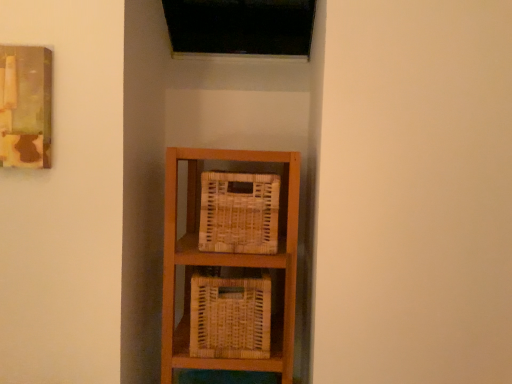
Question: From the image's perspective, would you say woven natural basket at center, marked as the 2th basket in a bottom-to-top arrangement, is positioned over woven wood basket at center, arranged as the first basket when ordered from the bottom?

Choices:
 (A) yes
 (B) no

Answer: (A)

Question: Is woven natural basket at center, marked as the 2th basket in a bottom-to-top arrangement, shorter than woven wood basket at center, arranged as the first basket when ordered from the bottom?

Choices:
 (A) yes
 (B) no

Answer: (A)

Question: Are woven natural basket at center, positioned as the first basket in top-to-bottom order, and woven wood basket at center, arranged as the first basket when ordered from the bottom, making contact?

Choices:
 (A) no
 (B) yes

Answer: (A)

Question: Is the position of woven natural basket at center, marked as the 2th basket in a bottom-to-top arrangement, more distant than that of woven wood basket at center, arranged as the first basket when ordered from the bottom?

Choices:
 (A) no
 (B) yes

Answer: (B)

Question: Does woven natural basket at center, marked as the 2th basket in a bottom-to-top arrangement, have a lesser width compared to woven wood basket at center, arranged as the first basket when ordered from the bottom?

Choices:
 (A) no
 (B) yes

Answer: (B)

Question: Is woven wood basket at center, arranged as the first basket when ordered from the bottom, wider or thinner than woven natural basket at center, positioned as the first basket in top-to-bottom order?

Choices:
 (A) wide
 (B) thin

Answer: (A)

Question: From a real-world perspective, is woven wood basket at center, arranged as the first basket when ordered from the bottom, physically located above or below woven natural basket at center, marked as the 2th basket in a bottom-to-top arrangement?

Choices:
 (A) below
 (B) above

Answer: (A)

Question: In the image, is woven wood basket at center, arranged as the first basket when ordered from the bottom, positioned in front of or behind woven natural basket at center, marked as the 2th basket in a bottom-to-top arrangement?

Choices:
 (A) behind
 (B) front

Answer: (B)

Question: Is woven wood basket at center, acting as the second basket starting from the top, inside the boundaries of woven natural basket at center, marked as the 2th basket in a bottom-to-top arrangement, or outside?

Choices:
 (A) outside
 (B) inside

Answer: (A)

Question: Considering the relative positions of woven natural basket at center, marked as the 2th basket in a bottom-to-top arrangement, and woven wood basket at center, acting as the second basket starting from the top, in the image provided, is woven natural basket at center, marked as the 2th basket in a bottom-to-top arrangement, to the left or to the right of woven wood basket at center, acting as the second basket starting from the top,?

Choices:
 (A) right
 (B) left

Answer: (A)

Question: Choose the correct answer: Is woven natural basket at center, positioned as the first basket in top-to-bottom order, inside woven wood basket at center, acting as the second basket starting from the top, or outside it?

Choices:
 (A) inside
 (B) outside

Answer: (B)

Question: In the image, is woven natural basket at center, positioned as the first basket in top-to-bottom order, positioned in front of or behind woven wood basket at center, acting as the second basket starting from the top?

Choices:
 (A) front
 (B) behind

Answer: (B)

Question: From their relative heights in the image, would you say woven natural basket at center, marked as the 2th basket in a bottom-to-top arrangement, is taller or shorter than woven wood basket at center, arranged as the first basket when ordered from the bottom?

Choices:
 (A) tall
 (B) short

Answer: (B)

Question: Is wooden painting at upper left wider or thinner than woven wood basket at center, arranged as the first basket when ordered from the bottom?

Choices:
 (A) wide
 (B) thin

Answer: (B)

Question: Is wooden painting at upper left situated inside woven wood basket at center, arranged as the first basket when ordered from the bottom, or outside?

Choices:
 (A) outside
 (B) inside

Answer: (A)